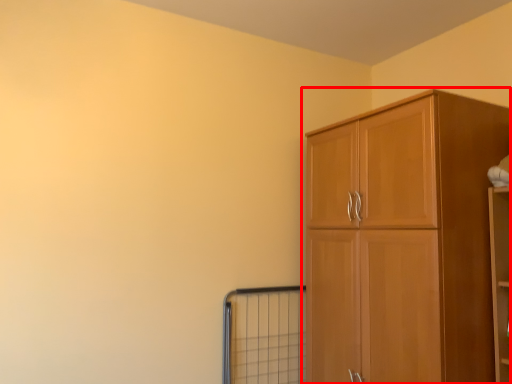
Question: From the image's perspective, where is cupboard (annotated by the red box) located relative to window?

Choices:
 (A) above
 (B) below

Answer: (A)